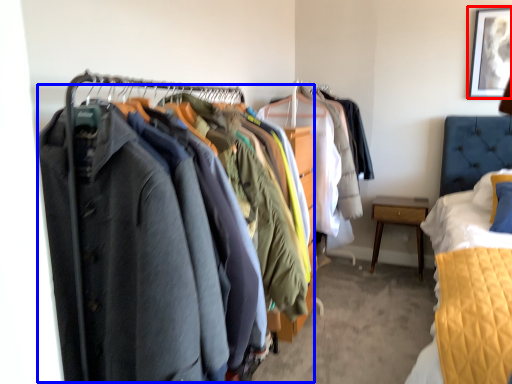
Question: Which of the following is the closest to the observer, picture frame (highlighted by a red box) or closet (highlighted by a blue box)?

Choices:
 (A) picture frame
 (B) closet

Answer: (B)